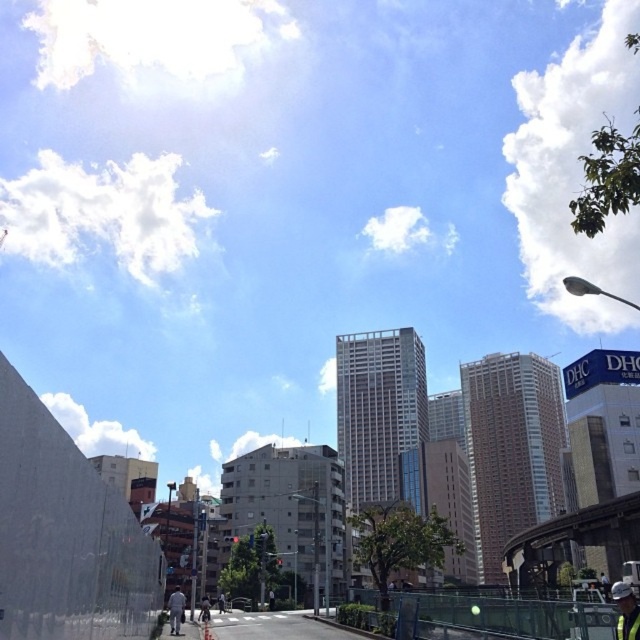
You are a city planner standing at the construction site. You see a hard hat at center and a white fabric man at lower center. How far apart are these two objects?

The hard hat at center is 97.75 feet away from the white fabric man at lower center.

You are a city planner analyzing the urban layout. There is a point labeled as point (625, 611) on hard hat at center. Based on the scene description, can you determine the purpose of the hard hat at center in this urban environment?

The hard hat at center is likely worn by a construction worker, indicating ongoing construction activity in the area. This aligns with the presence of a large light colored wall possibly being a construction barrier mentioned in the scene description.

You are a pedestrian standing at the crosswalk and see a hard hat at center and a white fabric man at lower center. Which object is closer to you?

The hard hat at center is closer to you because it is in front of the white fabric man at lower center.